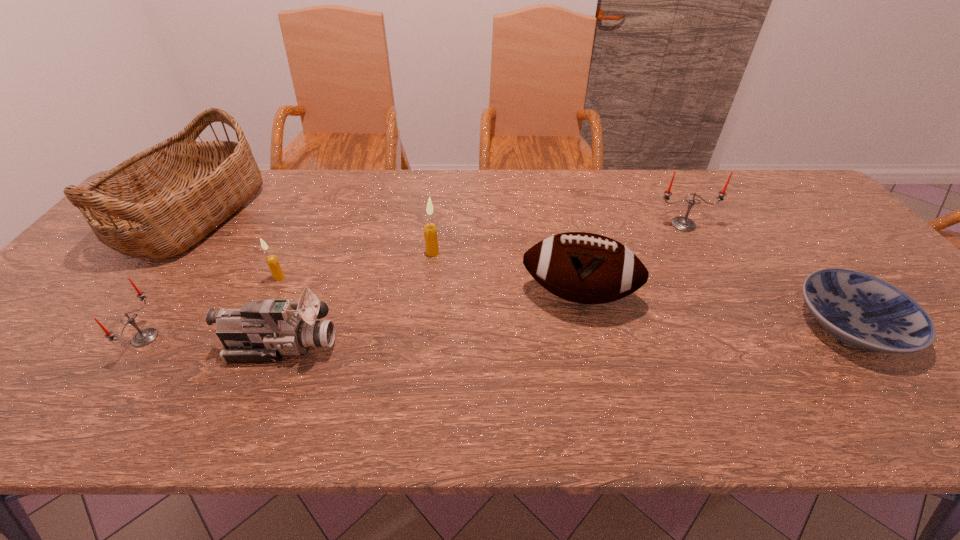
The width and height of the screenshot is (960, 540). Find the location of `the leftmost candle`. the leftmost candle is located at coordinates (143, 337).

Where is `the smaller red candle`? the smaller red candle is located at coordinates (143, 337).

This screenshot has width=960, height=540. Identify the location of the shortest object. point(864,311).

Where is `plate`? The width and height of the screenshot is (960, 540). plate is located at coordinates (864, 311).

Identify the location of free space located on the right of the basket. The height and width of the screenshot is (540, 960). (363, 215).

You are a GUI agent. You are given a task and a screenshot of the screen. Output one action in this format:
    pyautogui.click(x=<x>, y=<y>)
    Task: Click on the free space located 0.220m on the front-facing side of the farther red candle
    Image resolution: width=960 pixels, height=540 pixels.
    Given the screenshot: What is the action you would take?
    pyautogui.click(x=717, y=286)

Where is `vacant space located on the right of the second candle from right to left`? Image resolution: width=960 pixels, height=540 pixels. vacant space located on the right of the second candle from right to left is located at coordinates (487, 253).

Where is `vacant space located 0.210m on the front of the football (American)`? vacant space located 0.210m on the front of the football (American) is located at coordinates (603, 403).

At what (x,y) coordinates should I click in order to perform the action: click on vacant space located 0.380m on the front-facing side of the camcorder. Please return your answer as a coordinate pair (x, y). This screenshot has width=960, height=540. Looking at the image, I should click on (507, 345).

Locate an element on the screen. The width and height of the screenshot is (960, 540). vacant space located on the left of the third candle from right to left is located at coordinates (138, 278).